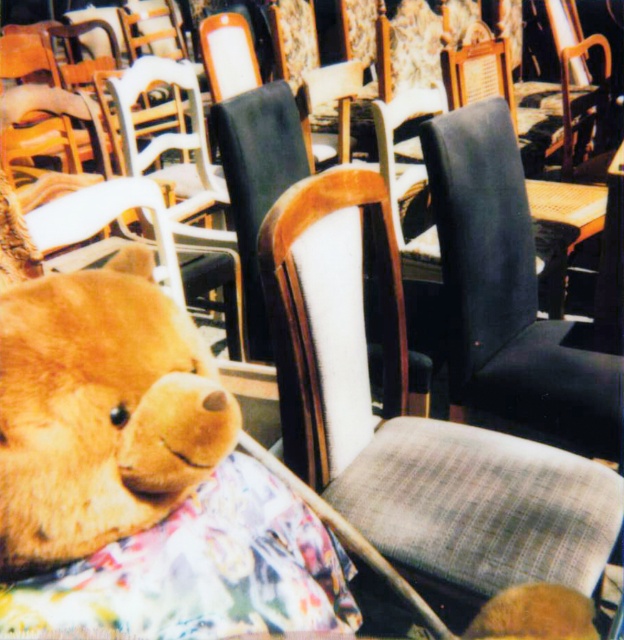
You are standing at the entrance of the room and see a point marked at coordinates (409, 419). According to the scene, what object is located at that point?

The point at coordinates (409, 419) corresponds to the plaid fabric chair at center.